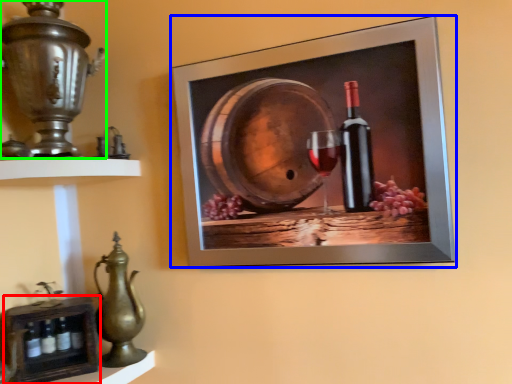
Question: Based on their relative distances, which object is nearer to shelf (highlighted by a red box)? Choose from picture frame (highlighted by a blue box) and candle holder (highlighted by a green box).

Choices:
 (A) picture frame
 (B) candle holder

Answer: (B)